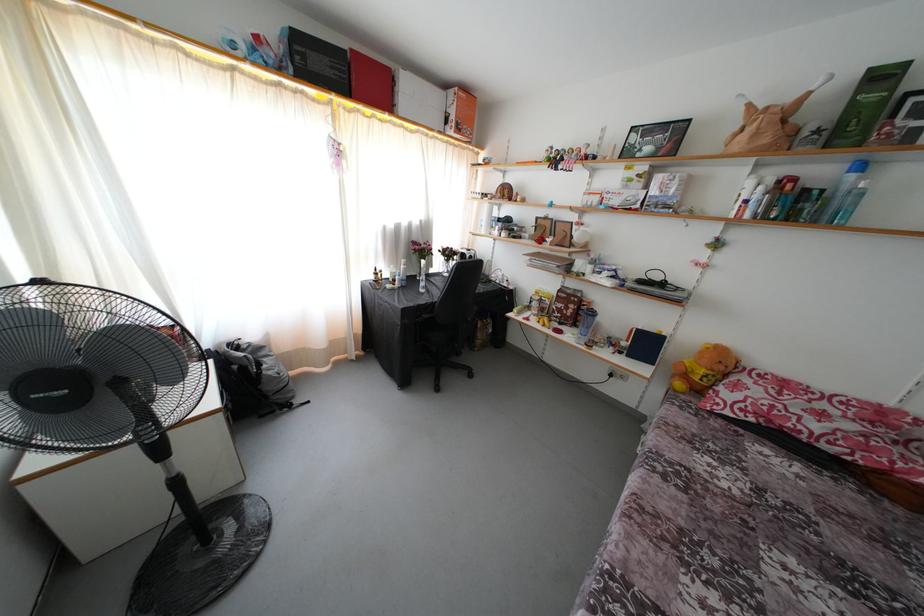
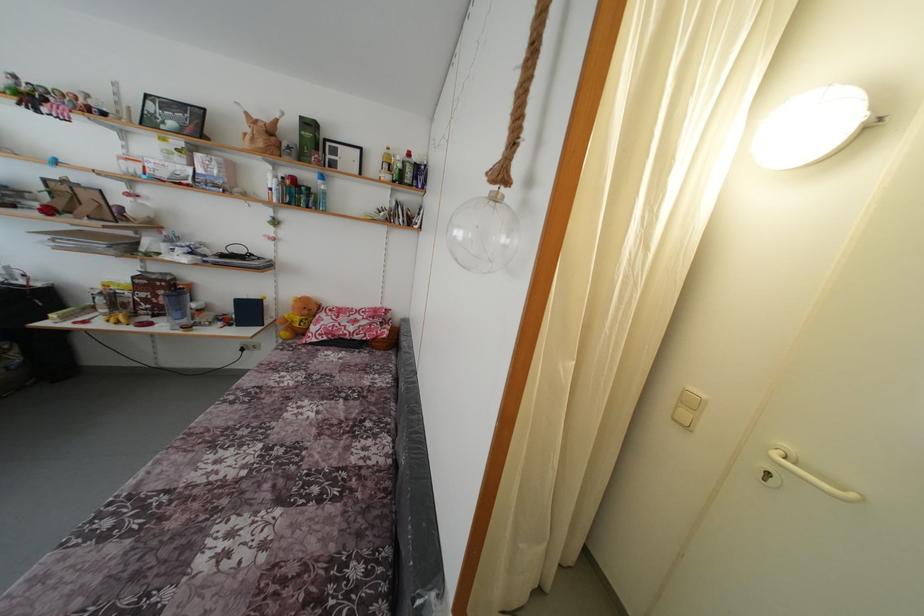
The point at (565, 310) is marked in the first image. Where is the corresponding point in the second image?

(149, 301)